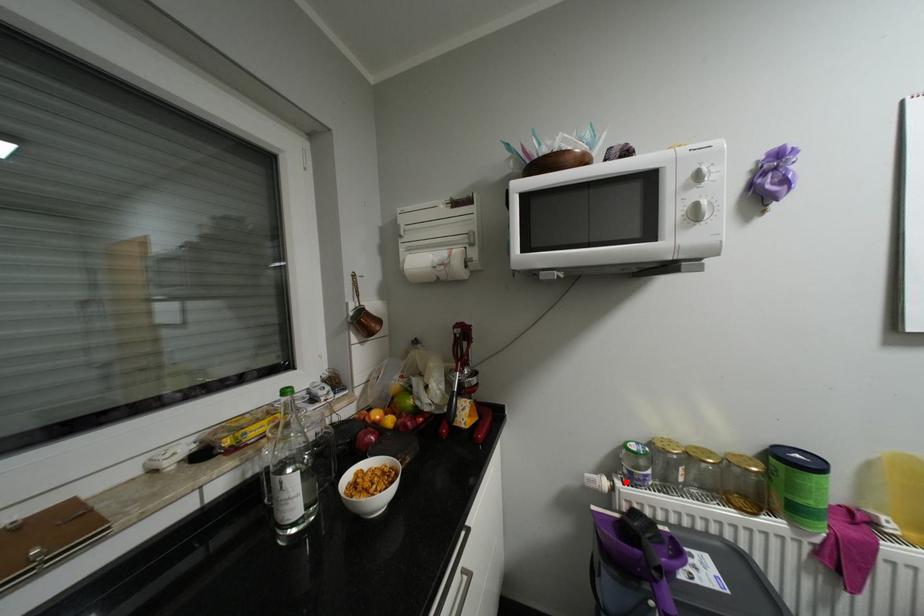
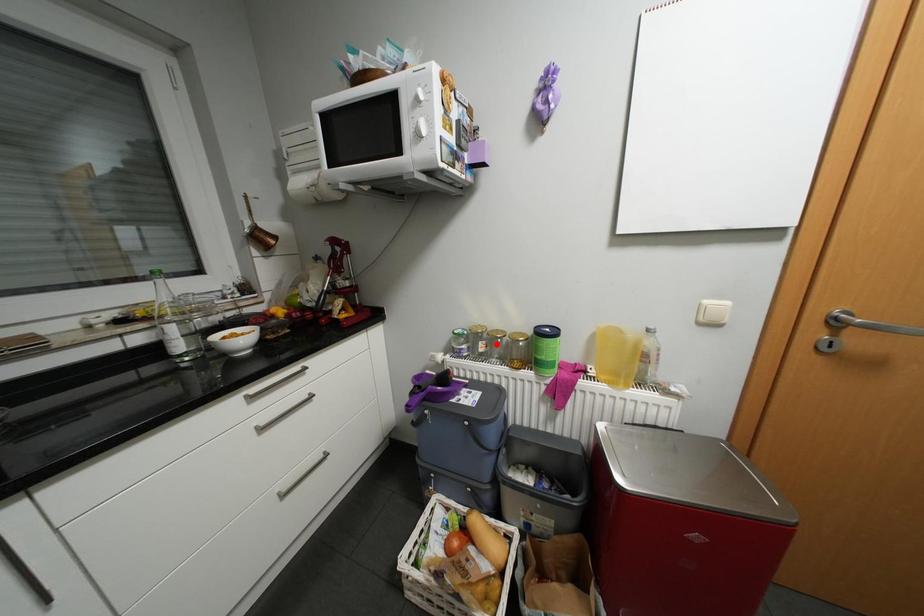
I am providing you with two images of the same scene from different viewpoints. A red point is marked on the first image and another point is marked on the second image. Are the points marked in image1 and image2 representing the same 3D position?

No